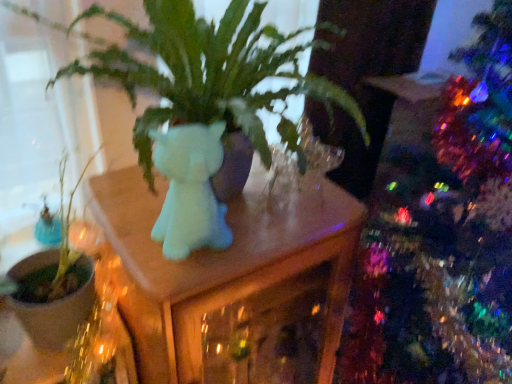
The image size is (512, 384). I want to click on matte white unicorn at center, so click(224, 267).

What do you see at coordinates (190, 190) in the screenshot? The width and height of the screenshot is (512, 384). I see `matte white cat at center` at bounding box center [190, 190].

At what (x,y) coordinates should I click in order to perform the action: click on green matte plant at left. Please return your answer as a coordinate pair (x, y). The width and height of the screenshot is (512, 384). Looking at the image, I should click on (54, 284).

Which of these two, green matte plant at left or matte white unicorn at center, stands taller?

matte white unicorn at center is taller.

Is green matte plant at left positioned with its back to matte white unicorn at center?

No, matte white unicorn at center is not at the back of green matte plant at left.

What's the angular difference between green matte plant at left and matte white unicorn at center's facing directions?

The angle between the facing direction of green matte plant at left and the facing direction of matte white unicorn at center is 2.54 degrees.

How different are the orientations of matte white unicorn at center and green matte plant at left in degrees?

The facing directions of matte white unicorn at center and green matte plant at left are 2.54 degrees apart.

Considering their positions, is matte white unicorn at center located in front of or behind green matte plant at left?

In the image, matte white unicorn at center appears in front of green matte plant at left.

Does point (177, 372) come in front of point (37, 336)?

Yes, it is.

Is matte white unicorn at center outside of green matte plant at left?

Yes, matte white unicorn at center is located beyond the bounds of green matte plant at left.

Is matte white cat at center behind matte white unicorn at center?

No, it is not.

Considering the relative sizes of matte white cat at center and matte white unicorn at center in the image provided, is matte white cat at center bigger than matte white unicorn at center?

Incorrect, matte white cat at center is not larger than matte white unicorn at center.

Is matte white cat at center positioned far away from matte white unicorn at center?

No.

Looking at this image, which object is closer to the camera, green matte plant at left or matte white cat at center?

Positioned in front is matte white cat at center.

Is point (80, 309) closer to camera compared to point (218, 166)?

No, it is behind (218, 166).

Considering the sizes of green matte plant at left and matte white cat at center in the image, is green matte plant at left taller or shorter than matte white cat at center?

Considering their sizes, green matte plant at left has more height than matte white cat at center.

Between matte white unicorn at center and matte white cat at center, which one is positioned behind?

matte white unicorn at center is behind.

Does matte white unicorn at center contain matte white cat at center?

No, matte white cat at center is not a part of matte white unicorn at center.

Can you tell me how much matte white unicorn at center and matte white cat at center differ in facing direction?

0.886 degrees separate the facing orientations of matte white unicorn at center and matte white cat at center.

Considering the relative sizes of matte white unicorn at center and matte white cat at center in the image provided, is matte white unicorn at center bigger than matte white cat at center?

Correct, matte white unicorn at center is larger in size than matte white cat at center.

Is matte white cat at center oriented towards green matte plant at left?

No, matte white cat at center is not oriented towards green matte plant at left.

Can you tell me how much matte white cat at center and green matte plant at left differ in facing direction?

The angle between the facing direction of matte white cat at center and the facing direction of green matte plant at left is 1.65 degrees.

Which is more to the left, matte white cat at center or green matte plant at left?

Positioned to the left is green matte plant at left.

Is matte white cat at center bigger or smaller than green matte plant at left?

In the image, matte white cat at center appears to be smaller than green matte plant at left.

At what (x,y) coordinates should I click in order to perform the action: click on houseplant above the matte white unicorn at center (from a real-world perspective). Please return your answer as a coordinate pair (x, y). Looking at the image, I should click on (54, 284).

At what (x,y) coordinates should I click in order to perform the action: click on table that is in front of the green matte plant at left. Please return your answer as a coordinate pair (x, y). This screenshot has width=512, height=384. Looking at the image, I should click on (224, 267).

Estimate the real-world distances between objects in this image. Which object is further from matte white unicorn at center, matte white cat at center or green matte plant at left?

green matte plant at left.

When comparing their distances from matte white unicorn at center, does green matte plant at left or matte white cat at center seem closer?

matte white cat at center lies closer to matte white unicorn at center than the other object.

From the image, which object appears to be nearer to matte white cat at center, green matte plant at left or matte white unicorn at center?

The object closer to matte white cat at center is matte white unicorn at center.

Which object lies further to the anchor point green matte plant at left, matte white unicorn at center or matte white cat at center?

matte white cat at center is positioned further to the anchor green matte plant at left.

Considering their positions, is matte white unicorn at center positioned closer to matte white cat at center than green matte plant at left?

Based on the image, matte white unicorn at center appears to be nearer to matte white cat at center.

Looking at the image, which one is located closer to green matte plant at left, matte white cat at center or matte white unicorn at center?

The object closer to green matte plant at left is matte white unicorn at center.

This screenshot has height=384, width=512. What are the coordinates of `houseplant between matte white cat at center and matte white unicorn at center from top to bottom` in the screenshot? It's located at (54, 284).